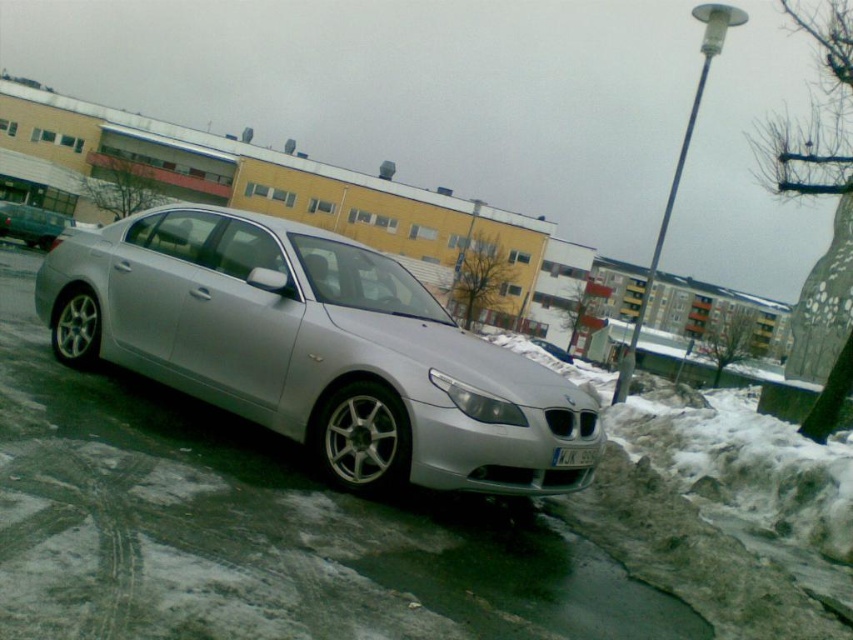
Question: Is satin silver car at center smaller than white plastic license plate at lower center?

Choices:
 (A) yes
 (B) no

Answer: (B)

Question: Does satin silver car at center appear on the right side of white plastic license plate at lower center?

Choices:
 (A) yes
 (B) no

Answer: (B)

Question: Which point is farther to the camera?

Choices:
 (A) satin silver car at center
 (B) white plastic license plate at lower center

Answer: (B)

Question: Can you confirm if satin silver car at center is positioned to the left of white plastic license plate at lower center?

Choices:
 (A) no
 (B) yes

Answer: (B)

Question: Which point is farther from the camera taking this photo?

Choices:
 (A) (381, 445)
 (B) (554, 467)

Answer: (B)